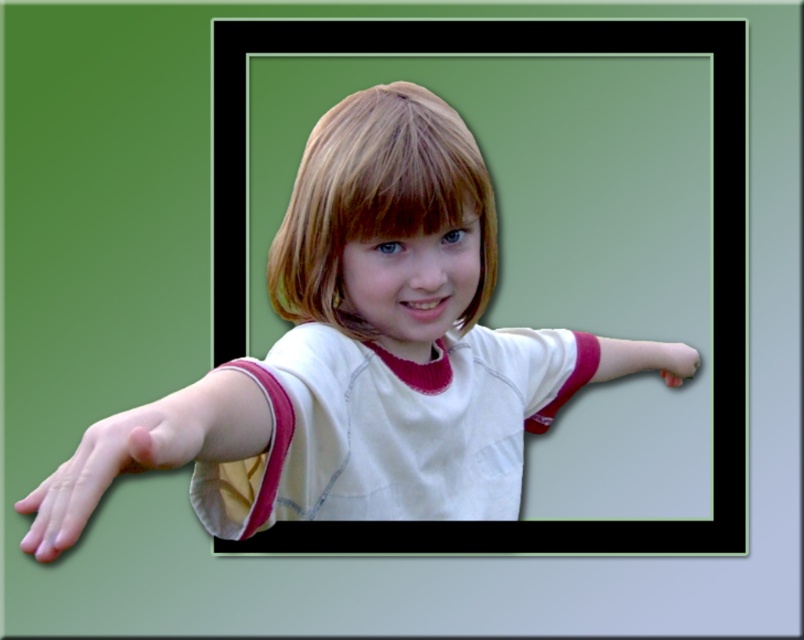
Question: Does pink fabric arm at lower left have a lesser width compared to blonde hair at center?

Choices:
 (A) no
 (B) yes

Answer: (B)

Question: Does blonde hair at center have a lesser width compared to pink matte hand at lower right?

Choices:
 (A) yes
 (B) no

Answer: (B)

Question: Considering the real-world distances, which object is farthest from the smooth skin hand at lower left?

Choices:
 (A) white fabric arm at center
 (B) blonde smooth hair at center
 (C) pink matte hand at lower right

Answer: (C)

Question: Which of the following is the closest to the observer?

Choices:
 (A) white cotton shirt at center
 (B) white fabric arm at center
 (C) smooth skin hand at lower left

Answer: (C)

Question: Considering the real-world distances, which object is farthest from the pink matte hand at lower right?

Choices:
 (A) blonde smooth hair at center
 (B) white fabric arm at center
 (C) blonde hair at center

Answer: (C)

Question: Can you confirm if blonde smooth hair at center is thinner than blonde hair at center?

Choices:
 (A) yes
 (B) no

Answer: (B)